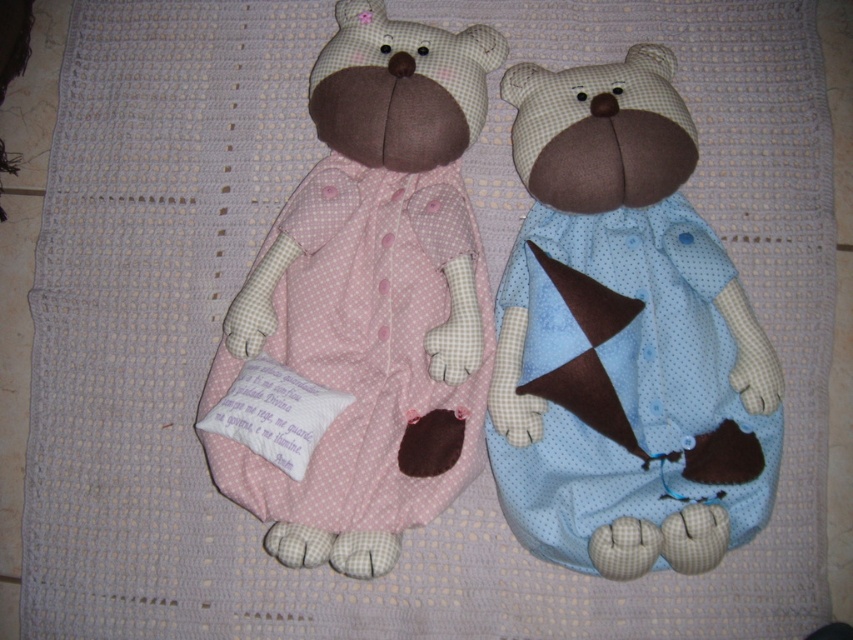
From the picture: You are organizing a teddy bear collection and need to place the matte blue fabric teddy bear at right and the pink polka dot fabric teddy bear at center on a shelf. According to the image, which teddy bear should be placed to the left side of the shelf?

The pink polka dot fabric teddy bear at center should be placed to the left side of the shelf because the matte blue fabric teddy bear at right is to the right of it in the image.

You are organizing a teddy bear collection and want to place a new small decorative item between the matte blue fabric teddy bear at right and the pink polka dot fabric teddy bear at center. Based on their positions, which teddy bear will the decorative item be closer to?

The decorative item will be closer to the matte blue fabric teddy bear at right because it is positioned in front of the pink polka dot fabric teddy bear at center, meaning it is closer to the viewer and thus the space between them would place the item nearer to the blue bear.